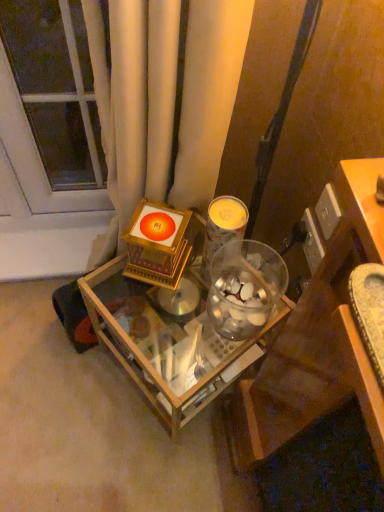
Question: Is transparent glass door at upper left not near wooden table at center?

Choices:
 (A) no
 (B) yes

Answer: (A)

Question: Does transparent glass door at upper left have a lesser width compared to wooden table at center?

Choices:
 (A) yes
 (B) no

Answer: (A)

Question: Is transparent glass door at upper left located outside wooden table at center?

Choices:
 (A) no
 (B) yes

Answer: (B)

Question: Does transparent glass door at upper left come behind wooden table at center?

Choices:
 (A) no
 (B) yes

Answer: (B)

Question: Is transparent glass door at upper left wider than wooden table at center?

Choices:
 (A) no
 (B) yes

Answer: (A)

Question: Is transparent glass door at upper left at the right side of wooden table at center?

Choices:
 (A) no
 (B) yes

Answer: (A)

Question: Does wooden table at center have a lesser height compared to transparent glass door at upper left?

Choices:
 (A) no
 (B) yes

Answer: (B)

Question: Does wooden table at center have a smaller size compared to transparent glass door at upper left?

Choices:
 (A) no
 (B) yes

Answer: (A)

Question: Is wooden table at center outside transparent glass door at upper left?

Choices:
 (A) no
 (B) yes

Answer: (B)

Question: From the image's perspective, is wooden table at center on transparent glass door at upper left?

Choices:
 (A) no
 (B) yes

Answer: (A)

Question: Could you tell me if wooden table at center is facing transparent glass door at upper left?

Choices:
 (A) no
 (B) yes

Answer: (A)

Question: Considering the relative sizes of wooden table at center and transparent glass door at upper left in the image provided, is wooden table at center wider than transparent glass door at upper left?

Choices:
 (A) yes
 (B) no

Answer: (A)

Question: Is transparent glass door at upper left directly adjacent to metallic silver candle at center?

Choices:
 (A) no
 (B) yes

Answer: (A)